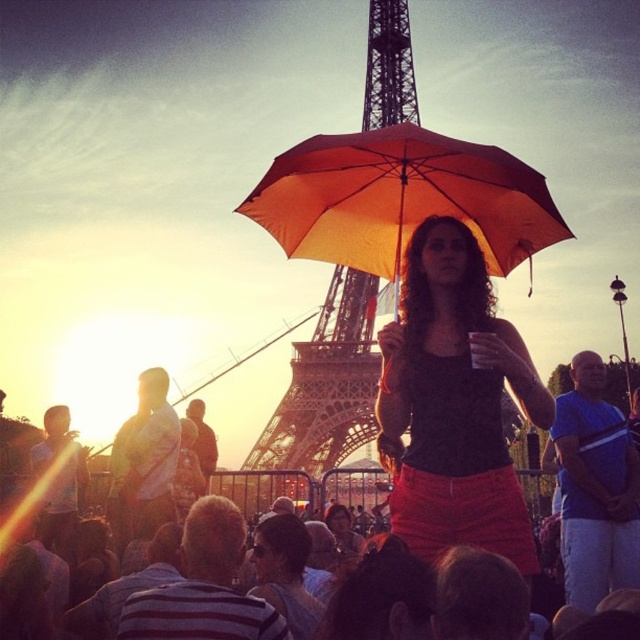
Is orange matte umbrella at center shorter than metallic structure at center?

Yes, orange matte umbrella at center is shorter than metallic structure at center.

Which is more to the left, orange matte umbrella at center or metallic structure at center?

metallic structure at center is more to the left.

Which is behind, point (381, 145) or point (276, 492)?

Positioned behind is point (276, 492).

Where is `orange matte umbrella at center`? orange matte umbrella at center is located at coordinates click(x=401, y=198).

Is orange matte umbrella at center positioned in front of matte black umbrella at center?

That is False.

Does orange matte umbrella at center appear over matte black umbrella at center?

Yes.

Where is `orange matte umbrella at center`? orange matte umbrella at center is located at coordinates (401, 198).

Is matte black tank top at center below matte black umbrella at center?

Incorrect, matte black tank top at center is not positioned below matte black umbrella at center.

Who is positioned more to the right, matte black tank top at center or matte black umbrella at center?

Positioned to the right is matte black tank top at center.

At what (x,y) coordinates should I click in order to perform the action: click on matte black tank top at center. Please return your answer as a coordinate pair (x, y). Looking at the image, I should click on (454, 403).